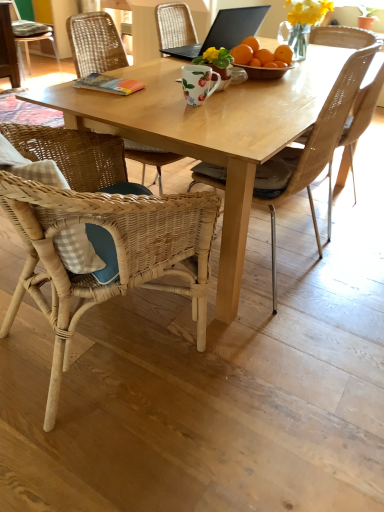
This screenshot has height=512, width=384. Find the location of `free space in front of woven wicker chair at lower left, the 4th chair when ordered from back to front`. free space in front of woven wicker chair at lower left, the 4th chair when ordered from back to front is located at coordinates (123, 451).